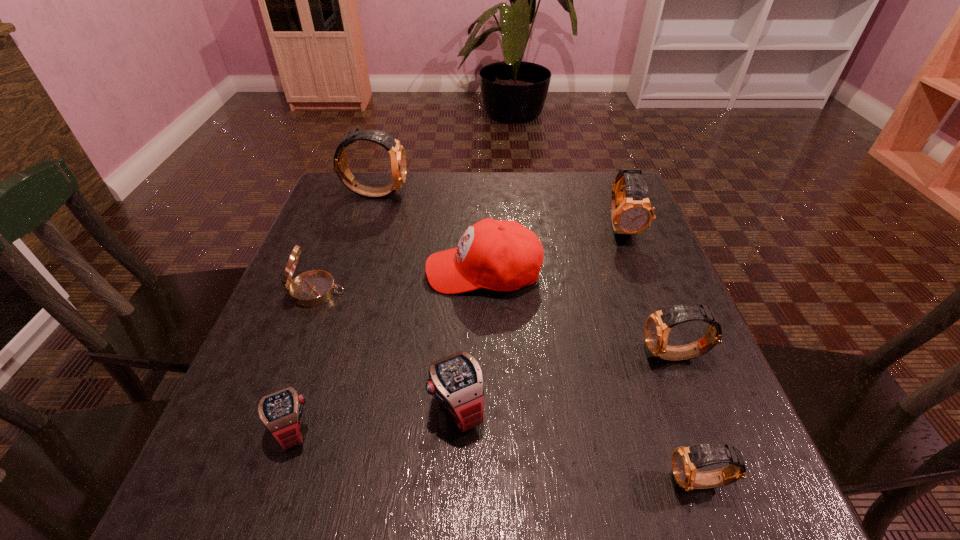
Locate which object is the fifth closest to the smallest gold watch. Please provide its 2D coordinates. Your answer should be formatted as a tuple, i.e. [(x, y)], where the tuple contains the x and y coordinates of a point satisfying the conditions above.

[(281, 412)]

Identify the location of the second closest watch to the baseball cap. (456, 381).

Identify which watch is the closest to the nearest watch. Please provide its 2D coordinates. Your answer should be formatted as a tuple, i.e. [(x, y)], where the tuple contains the x and y coordinates of a point satisfying the conditions above.

[(658, 324)]

Where is `gold watch that can be found as the third closest to the fourth nearest object`? gold watch that can be found as the third closest to the fourth nearest object is located at coordinates (397, 153).

The height and width of the screenshot is (540, 960). Find the location of `gold watch that is the second closest to the fifth farthest object`. gold watch that is the second closest to the fifth farthest object is located at coordinates (631, 212).

This screenshot has width=960, height=540. I want to click on free space that satisfies the following two spatial constraints: 1. on the face of the fifth shortest watch; 2. on the front panel of the baseball cap, so click(x=638, y=271).

Image resolution: width=960 pixels, height=540 pixels. I want to click on free region that satisfies the following two spatial constraints: 1. on the face of the second tallest watch; 2. on the face of the nearest watch, so click(721, 482).

You are a GUI agent. You are given a task and a screenshot of the screen. Output one action in this format:
    pyautogui.click(x=<x>, y=<y>)
    Task: Click on the free space that satisfies the following two spatial constraints: 1. on the face of the farthest object; 2. on the left side of the bigger red watch
    Image resolution: width=960 pixels, height=540 pixels.
    Given the screenshot: What is the action you would take?
    pyautogui.click(x=306, y=407)